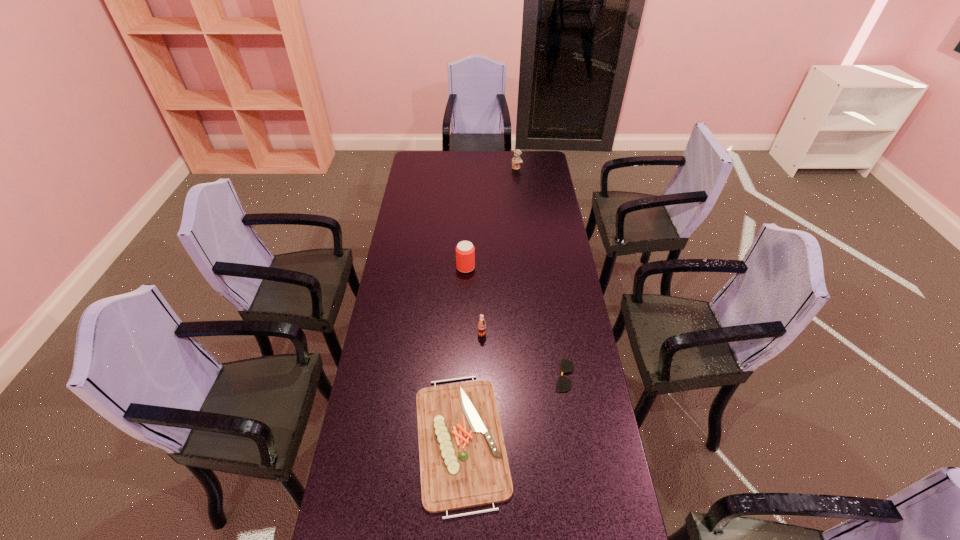
Select which object is the third closest to the soda. Please provide its 2D coordinates. Your answer should be formatted as a tuple, i.e. [(x, y)], where the tuple contains the x and y coordinates of a point satisfying the conditions above.

[(465, 251)]

Locate an element on the screen. This screenshot has width=960, height=540. object that is the third closest to the fourth nearest object is located at coordinates (563, 384).

You are a GUI agent. You are given a task and a screenshot of the screen. Output one action in this format:
    pyautogui.click(x=<x>, y=<y>)
    Task: Click on the vacant region that satisfies the following two spatial constraints: 1. on the front side of the fourth tallest object; 2. on the right side of the fourth nearest object
    
    Given the screenshot: What is the action you would take?
    pyautogui.click(x=460, y=440)

The width and height of the screenshot is (960, 540). In order to click on free space that satisfies the following two spatial constraints: 1. on the front-facing side of the rightmost object; 2. on the left side of the farthest object in this screenshot , I will do `click(540, 375)`.